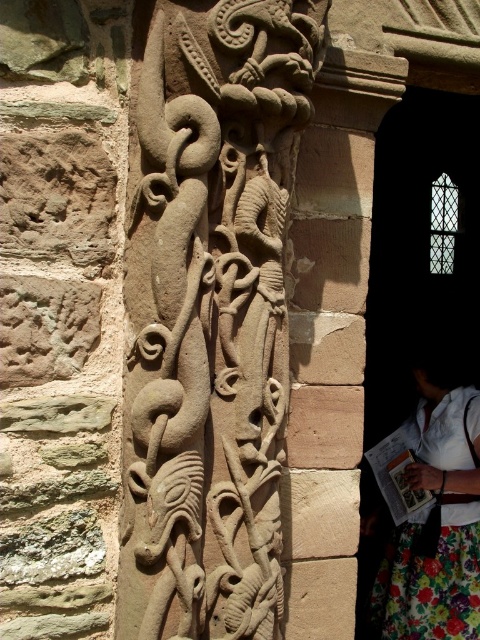
Question: Does stone textured dragon at center appear under carved stone pillar at center?

Choices:
 (A) yes
 (B) no

Answer: (B)

Question: Which of the following is the farthest from the observer?

Choices:
 (A) (321, 320)
 (B) (249, 486)

Answer: (A)

Question: Based on their relative distances, which object is nearer to the carved stone pillar at center?

Choices:
 (A) stone textured dragon at center
 (B) floral skirt at lower right

Answer: (A)

Question: Is the position of stone textured dragon at center less distant than that of carved stone pillar at center?

Choices:
 (A) no
 (B) yes

Answer: (B)

Question: Can you confirm if stone textured dragon at center is smaller than floral skirt at lower right?

Choices:
 (A) yes
 (B) no

Answer: (A)

Question: Among these objects, which one is nearest to the camera?

Choices:
 (A) stone textured dragon at center
 (B) floral skirt at lower right

Answer: (A)